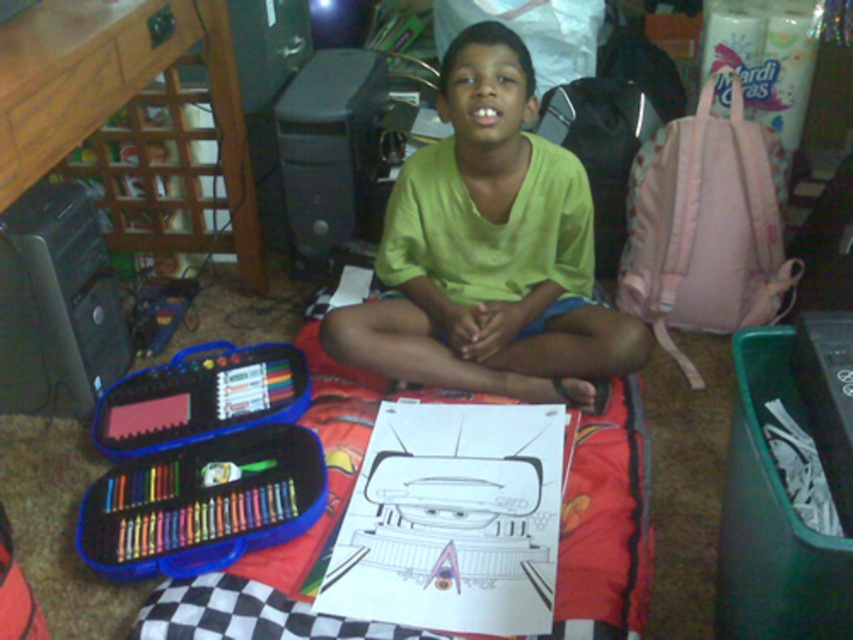
The boy is sitting on a blanket indoors. He has a drawing of a robot in front of him. There is a point marked at coordinates (x=489, y=252). What object is located at that point?

The point at coordinates (x=489, y=252) indicates the green matte shirt at center.

Based on the scene, which object is taller between the green matte shirt at center and the black checkered blanket at center?

The green matte shirt at center is taller than the black checkered blanket at center.

From the picture: You are a tailor measuring the distance between the green matte shirt at center and the black checkered blanket at center for a custom fitting. The minimum required space for proper tailoring is 12 inches. Can you proceed with the current spacing?

The distance between the green matte shirt at center and the black checkered blanket at center is 11.90 inches, which is slightly less than the required 12 inches. Therefore, you cannot proceed with the current spacing and need to adjust the positioning to meet the minimum requirement.